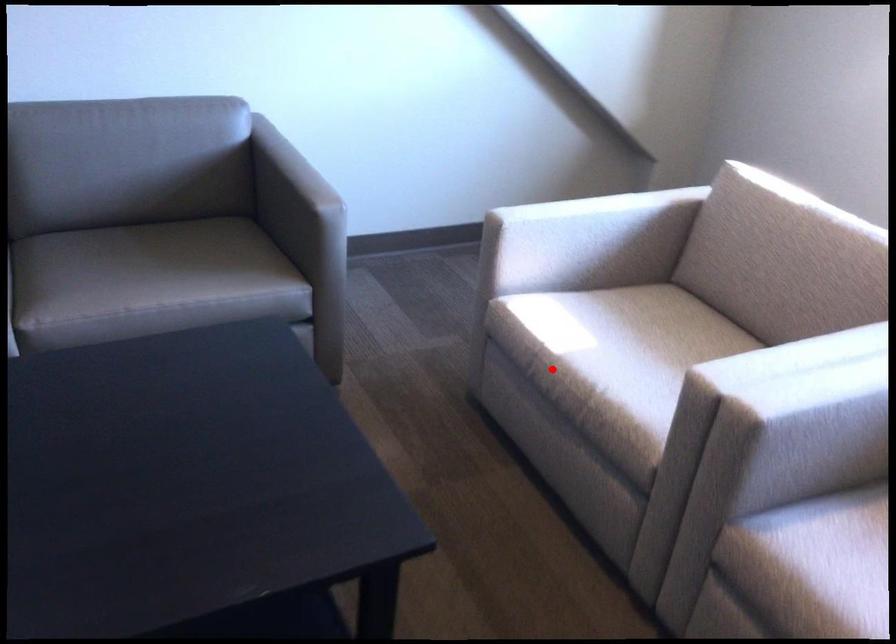
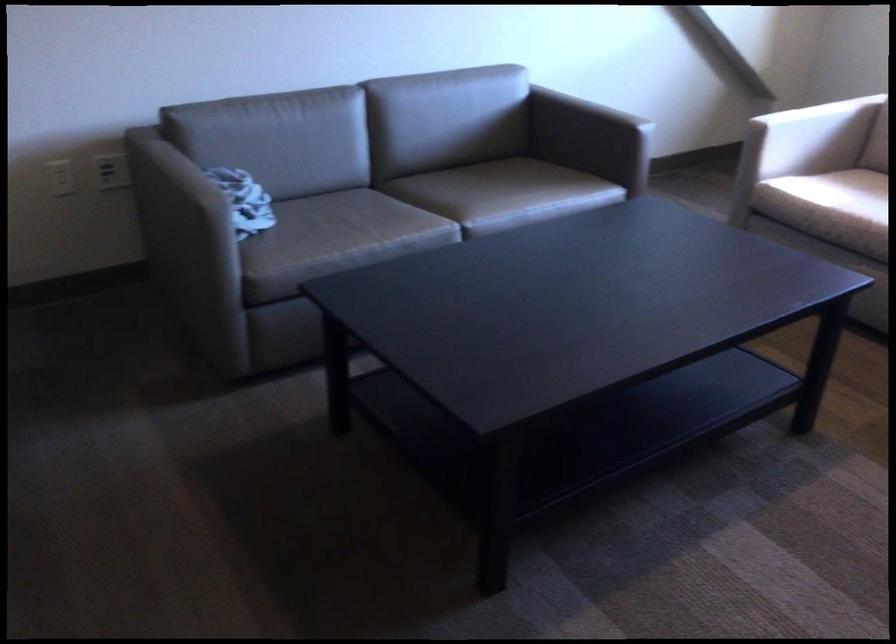
The point at the highlighted location is marked in the first image. Where is the corresponding point in the second image?

(821, 216)